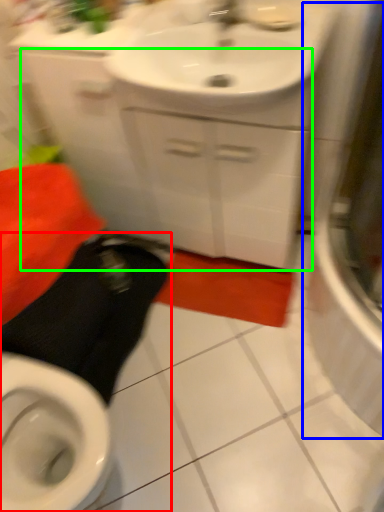
Question: Which object is the farthest from squat (highlighted by a red box)? Choose among these: screen door (highlighted by a blue box) or cabinetry (highlighted by a green box).

Choices:
 (A) screen door
 (B) cabinetry

Answer: (A)